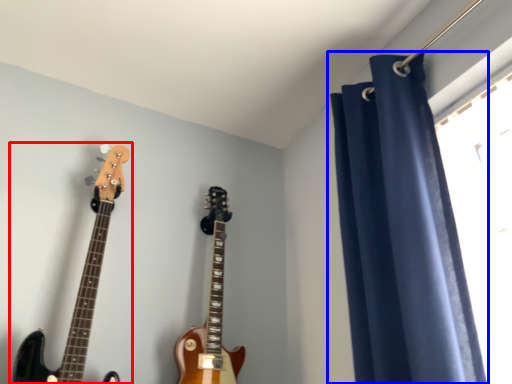
Question: Among these objects, which one is farthest to the camera, guitar (highlighted by a red box) or curtain (highlighted by a blue box)?

Choices:
 (A) guitar
 (B) curtain

Answer: (A)